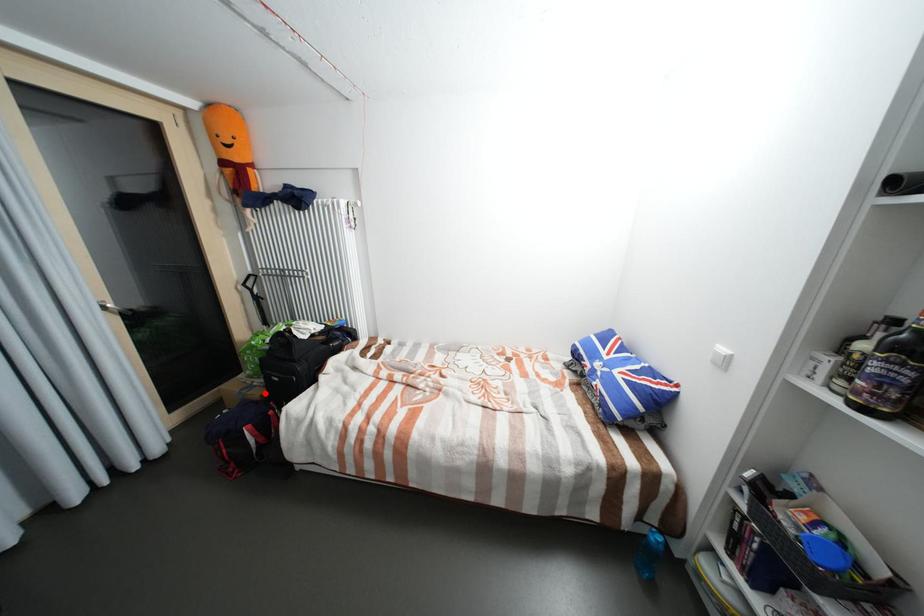
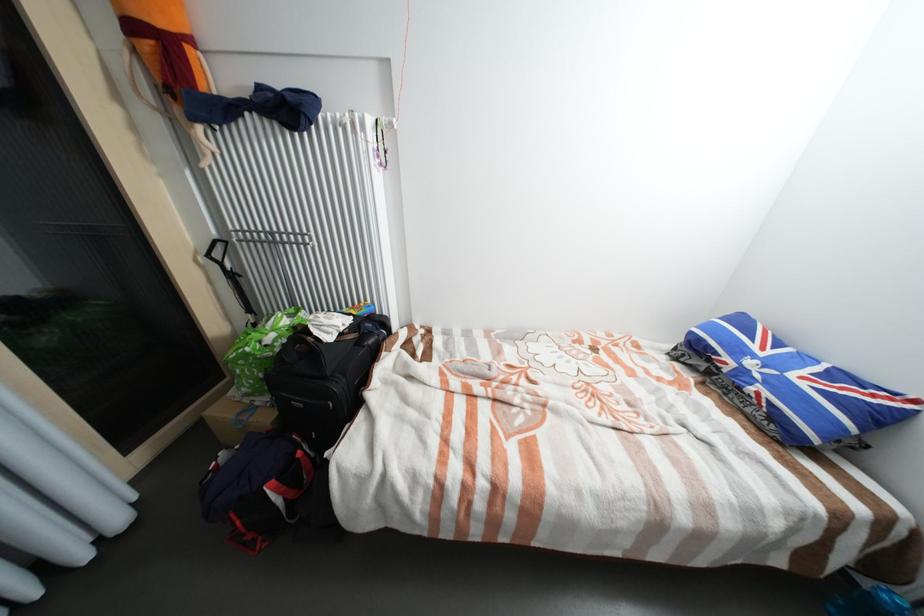
Question: I am providing you with two images of the same scene from different viewpoints. In image1, a red point is highlighted. Considering the same 3D point in image2, which of the following is correct?

Choices:
 (A) It is closer
 (B) It is farther

Answer: (B)